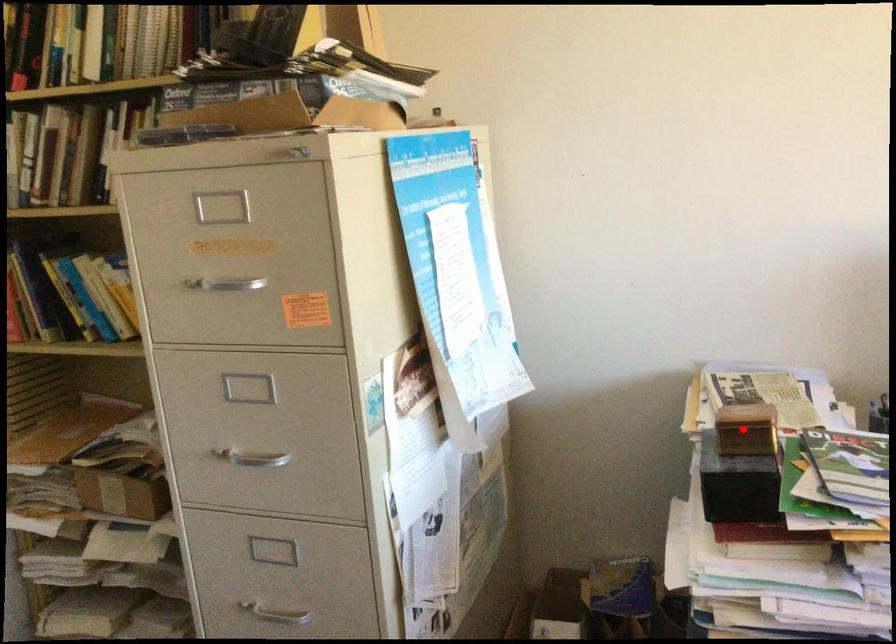
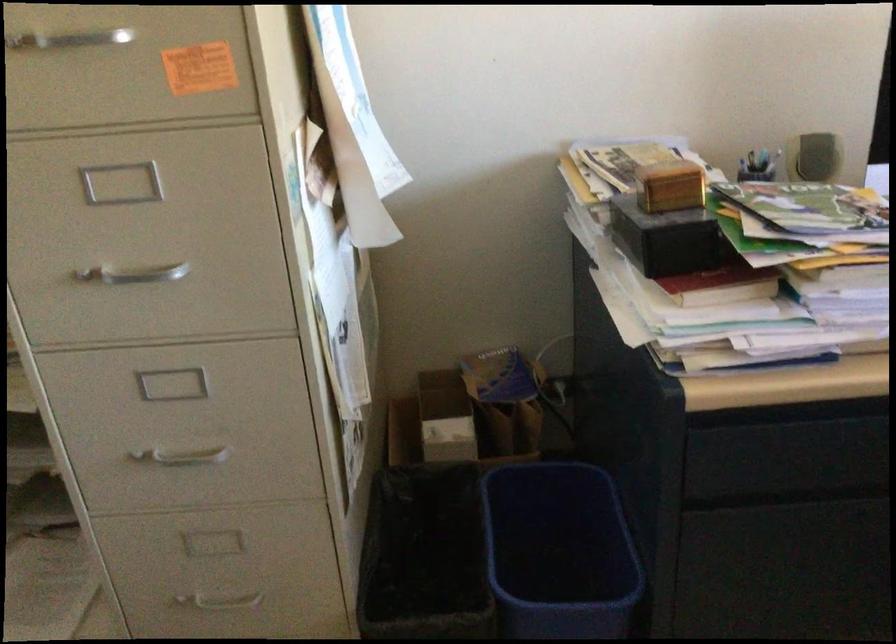
Find the pixel in the second image that matches the highlighted location in the first image.

(669, 185)